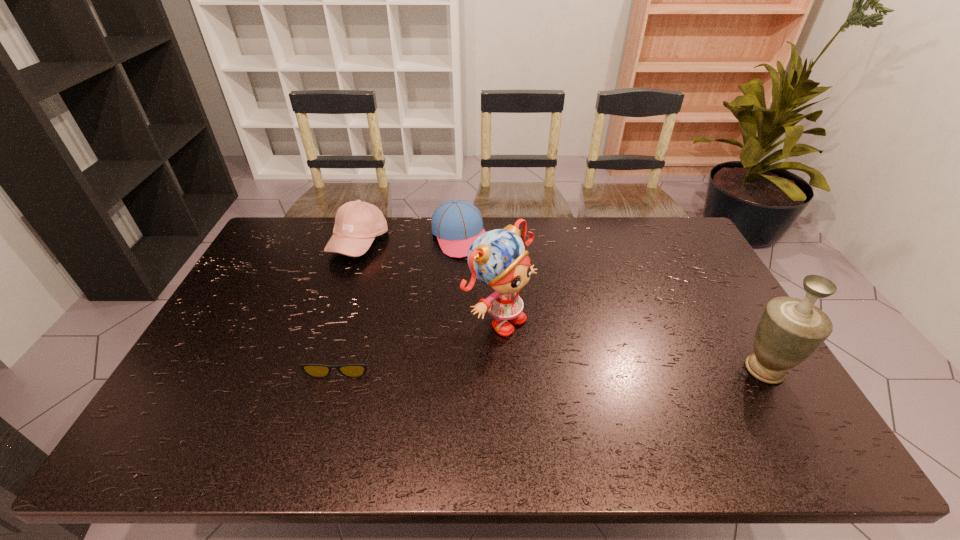
Find the location of a particular element. vacant area that lies between the shortest object and the left baseball cap is located at coordinates (350, 303).

I want to click on vacant area between the shorter baseball cap and the left baseball cap, so click(410, 240).

Where is `free spot between the second shortest object and the shortest object`? The width and height of the screenshot is (960, 540). free spot between the second shortest object and the shortest object is located at coordinates pos(401,300).

Locate an element on the screen. This screenshot has height=540, width=960. blank region between the right baseball cap and the shortest object is located at coordinates (401, 300).

Select which object appears as the closest to the urn. Please provide its 2D coordinates. Your answer should be formatted as a tuple, i.e. [(x, y)], where the tuple contains the x and y coordinates of a point satisfying the conditions above.

[(497, 258)]

Where is `the closest object to the doll`? the closest object to the doll is located at coordinates (457, 223).

Image resolution: width=960 pixels, height=540 pixels. What are the coordinates of `vacant space that satisfies the following two spatial constraints: 1. on the front side of the rightmost object; 2. on the left side of the doll` in the screenshot? It's located at (502, 370).